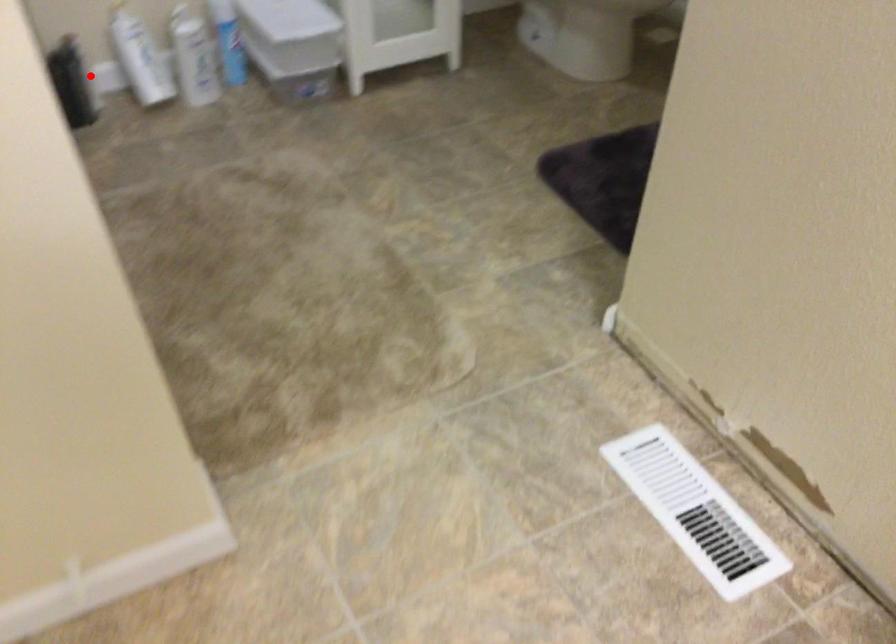
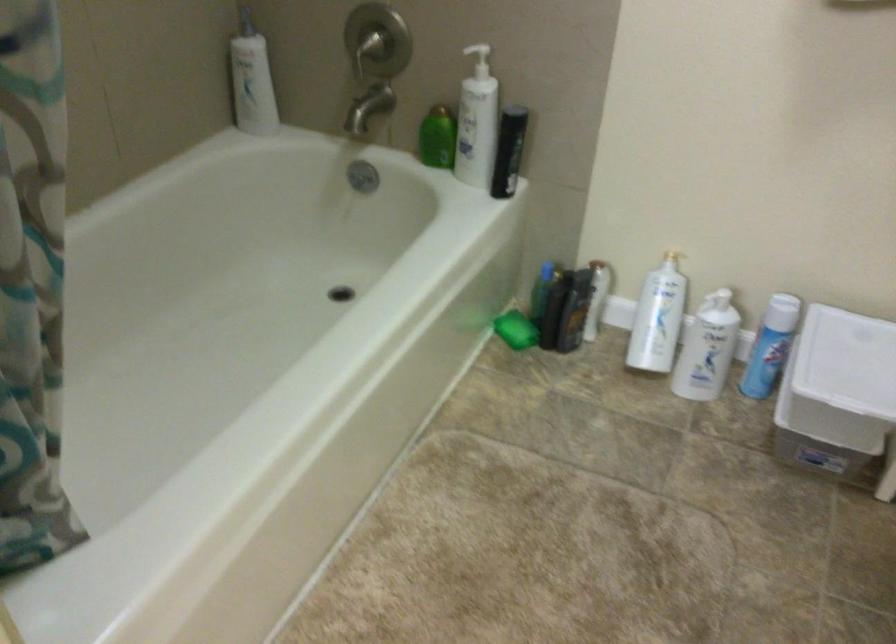
Question: I am providing you with two images of the same scene from different viewpoints. In image1, a red point is highlighted. Considering the same 3D point in image2, which of the following is correct?

Choices:
 (A) It is closer
 (B) It is farther

Answer: (A)